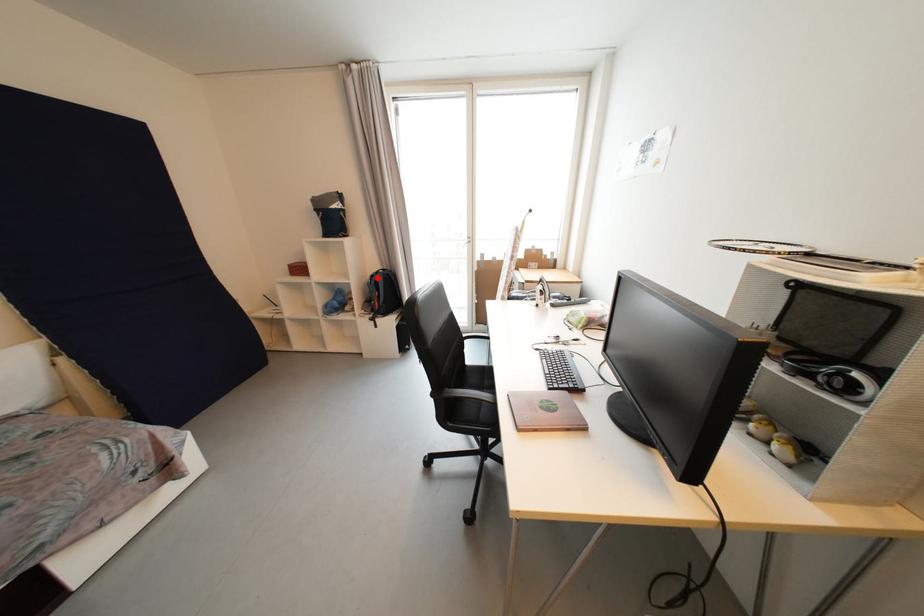
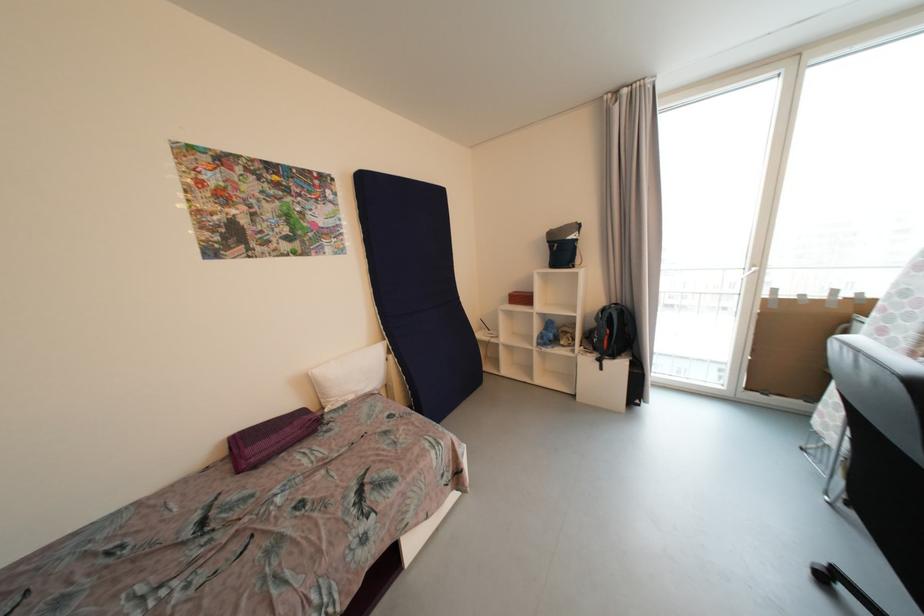
Question: I am providing you with two images of the same scene from different viewpoints. Image1 has a red point marked. In image2, the corresponding 3D location appears at what relative position? Reply with the corresponding letter.

Choices:
 (A) Closer
 (B) Farther

Answer: (B)